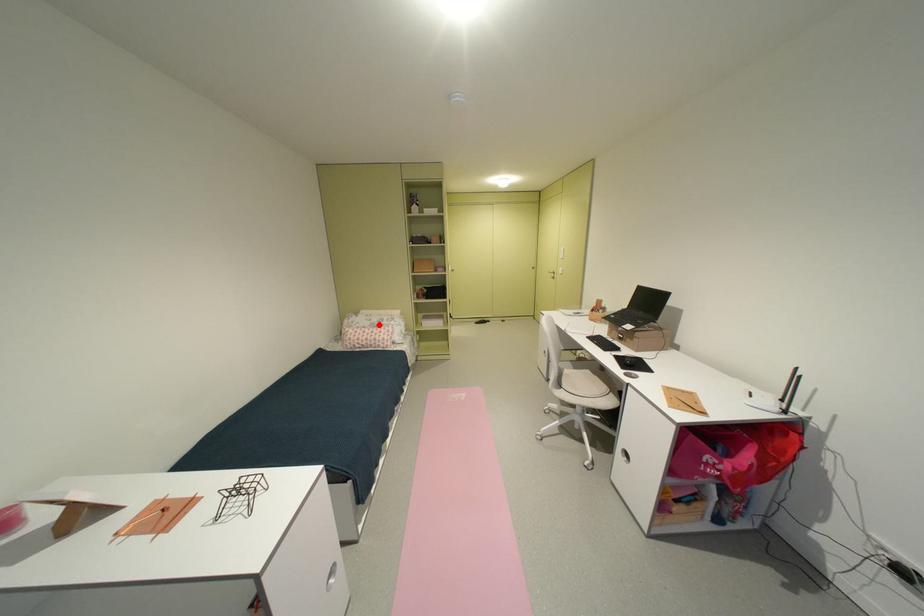
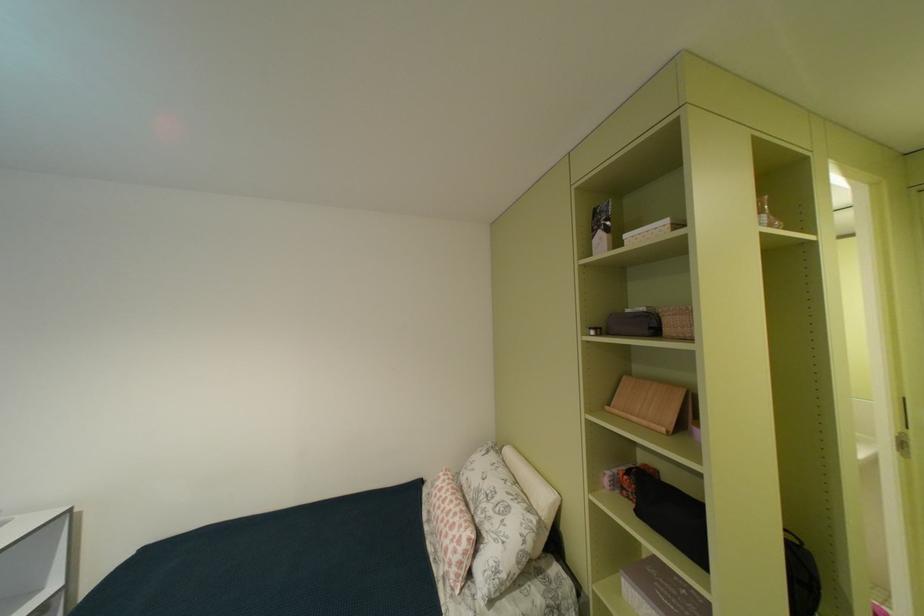
In the second image, find the point that corresponds to the highlighted location in the first image.

(487, 487)